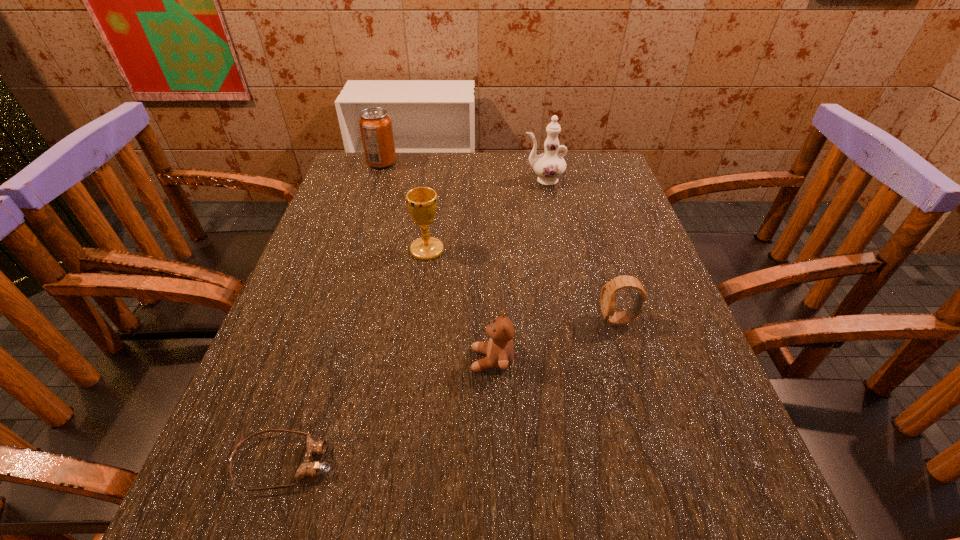
The width and height of the screenshot is (960, 540). In order to click on object positioned at the near left corner in this screenshot , I will do `click(308, 468)`.

Where is `object present at the far right corner`? The image size is (960, 540). object present at the far right corner is located at coordinates (550, 165).

The width and height of the screenshot is (960, 540). In order to click on free space at the far edge in this screenshot , I will do `click(502, 181)`.

Where is `vacant area at the near edge of the desktop`? vacant area at the near edge of the desktop is located at coordinates (444, 500).

In the image, there is a desktop. Identify the location of free space at the left edge. This screenshot has height=540, width=960. (251, 492).

Where is `vacant space at the right edge`? The width and height of the screenshot is (960, 540). vacant space at the right edge is located at coordinates (639, 414).

Locate an element on the screen. The width and height of the screenshot is (960, 540). free point at the far left corner is located at coordinates (339, 183).

In the image, there is a desktop. Where is `free space at the far right corner`? This screenshot has height=540, width=960. free space at the far right corner is located at coordinates (585, 156).

You are a GUI agent. You are given a task and a screenshot of the screen. Output one action in this format:
    pyautogui.click(x=<x>, y=<y>)
    Task: Click on the free area in between the watch and the teddy bear
    This screenshot has width=960, height=540.
    Given the screenshot: What is the action you would take?
    pyautogui.click(x=555, y=340)

Find the location of a particular element. empty space between the chinaware and the watch is located at coordinates (581, 250).